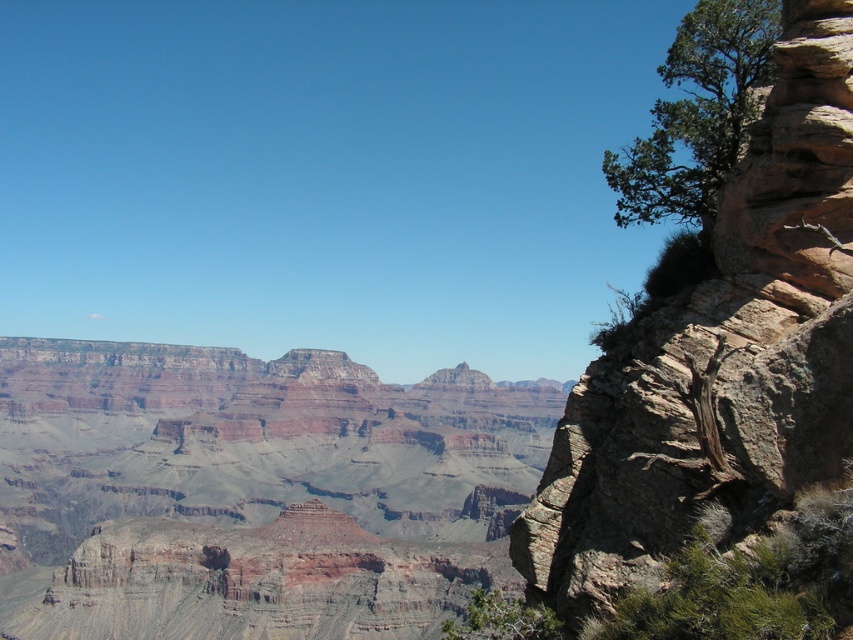
Question: Does rustic brown cliff at right come in front of green leafy tree at upper right?

Choices:
 (A) yes
 (B) no

Answer: (A)

Question: Estimate the real-world distances between objects in this image. Which object is closer to the green leafy tree at lower right?

Choices:
 (A) green leafy tree at upper right
 (B) rustic red rock canyon at center
 (C) rustic brown cliff at right

Answer: (C)

Question: Which point appears farthest from the camera in this image?

Choices:
 (A) (657, 144)
 (B) (764, 483)

Answer: (A)

Question: Which of these objects is positioned closest to the rustic red rock canyon at center?

Choices:
 (A) green leafy tree at lower right
 (B) green leafy tree at upper right

Answer: (A)

Question: Considering the relative positions of rustic brown cliff at right and green leafy tree at lower right in the image provided, where is rustic brown cliff at right located with respect to green leafy tree at lower right?

Choices:
 (A) left
 (B) right

Answer: (B)

Question: Is rustic red rock canyon at center to the right of rustic brown cliff at right from the viewer's perspective?

Choices:
 (A) yes
 (B) no

Answer: (B)